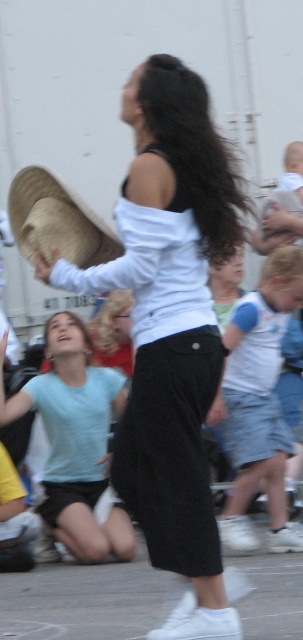
You are a photographer trying to capture a candid shot of the white matte shirt at center and the denim skirt at lower right. Since you want to highlight the height difference between them, which object should you focus on to emphasize their relative sizes?

The white matte shirt at center has a greater height compared to the denim skirt at lower right, so focusing on the white matte shirt at center will emphasize its taller height relative to the denim skirt at lower right.

You are organizing a costume party and need to ensure all items fit in a rectangular box. The box has a width of 1.2 meters. You have a white matte shirt at center and a brown straw hat at left. Based on their sizes, will both items fit side by side in the box?

The white matte shirt at center is wider than the brown straw hat at left. Since the box is 1.2 meters wide, the combined width of both items may exceed the box capacity. To confirm, you need to know the exact widths of both items.